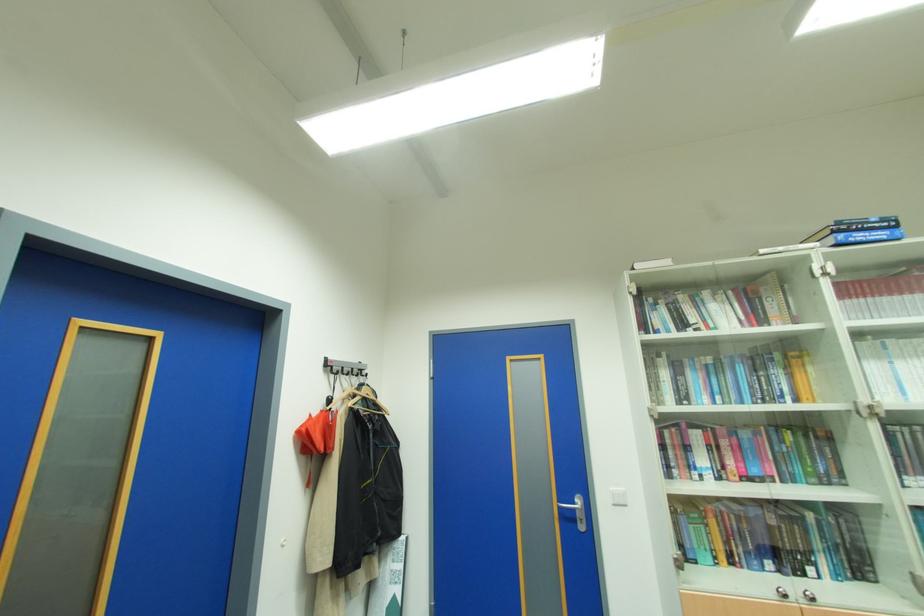
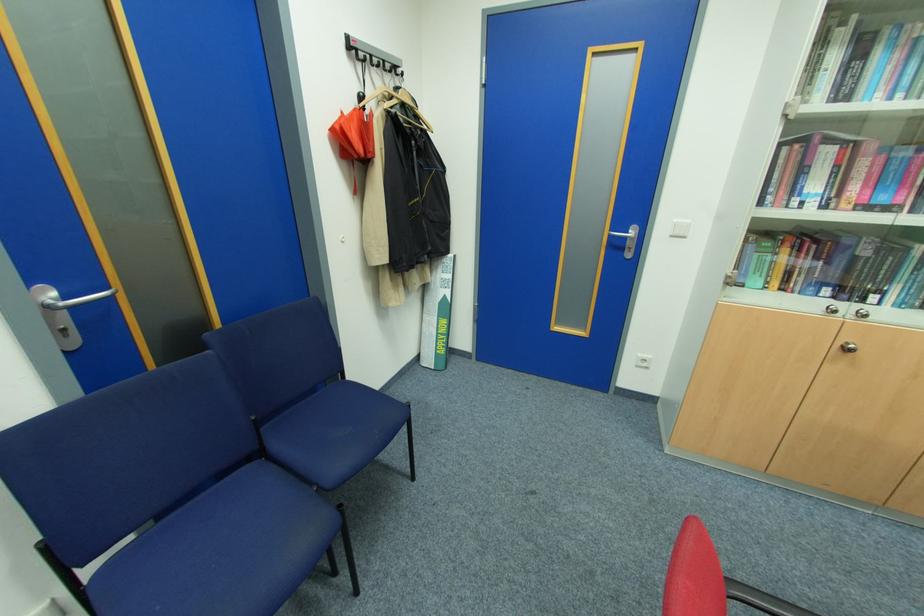
Locate, in the second image, the point that corresponds to pixel 617 505 in the first image.

(675, 236)